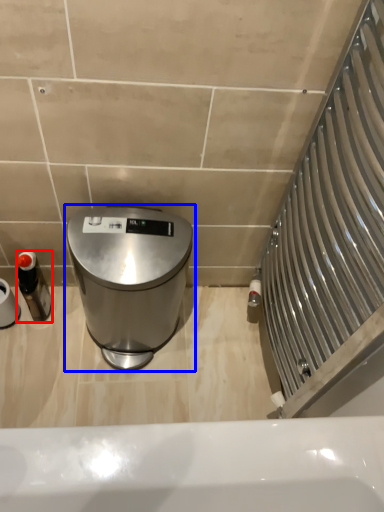
Question: Which point is further to the camera, bottle (highlighted by a red box) or waste container (highlighted by a blue box)?

Choices:
 (A) bottle
 (B) waste container

Answer: (A)